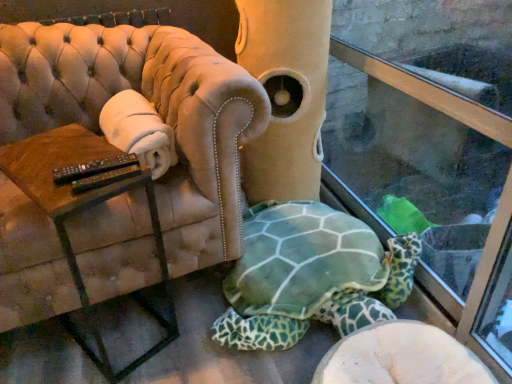
You are a GUI agent. You are given a task and a screenshot of the screen. Output one action in this format:
    pyautogui.click(x=<x>, y=<y>)
    Task: Click on the blank space situated above brown wooden table at left (from a real-world perspective)
    
    Given the screenshot: What is the action you would take?
    pyautogui.click(x=65, y=154)